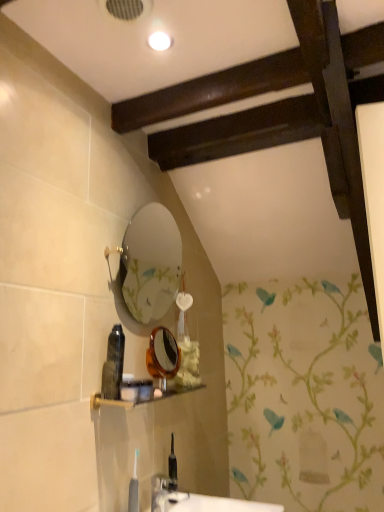
Question: Is matte plastic shelf at lower center at the left side of translucent amber mirror at center?

Choices:
 (A) yes
 (B) no

Answer: (A)

Question: Can you confirm if matte plastic shelf at lower center is taller than translucent amber mirror at center?

Choices:
 (A) yes
 (B) no

Answer: (B)

Question: Considering the relative sizes of matte plastic shelf at lower center and translucent amber mirror at center in the image provided, is matte plastic shelf at lower center bigger than translucent amber mirror at center?

Choices:
 (A) no
 (B) yes

Answer: (A)

Question: Considering the relative sizes of matte plastic shelf at lower center and translucent amber mirror at center in the image provided, is matte plastic shelf at lower center thinner than translucent amber mirror at center?

Choices:
 (A) yes
 (B) no

Answer: (B)

Question: Are matte plastic shelf at lower center and translucent amber mirror at center far apart?

Choices:
 (A) yes
 (B) no

Answer: (B)

Question: Is matte plastic shelf at lower center inside or outside of translucent plastic tube at center, the 2th toiletry from the top?

Choices:
 (A) inside
 (B) outside

Answer: (B)

Question: Looking at the image, does matte plastic shelf at lower center seem bigger or smaller compared to translucent plastic tube at center, acting as the third toiletry starting from the bottom?

Choices:
 (A) big
 (B) small

Answer: (A)

Question: In terms of height, does matte plastic shelf at lower center look taller or shorter compared to translucent plastic tube at center, acting as the third toiletry starting from the bottom?

Choices:
 (A) short
 (B) tall

Answer: (A)

Question: Does point (94, 402) appear closer or farther from the camera than point (139, 391)?

Choices:
 (A) closer
 (B) farther

Answer: (A)

Question: Would you say translucent plastic toothbrush at lower center, the second toiletry ordered from the bottom, is to the left or to the right of translucent amber mirror at center in the picture?

Choices:
 (A) left
 (B) right

Answer: (A)

Question: From a real-world perspective, relative to translucent amber mirror at center, is translucent plastic toothbrush at lower center, the third toiletry when ordered from top to bottom, vertically above or below?

Choices:
 (A) below
 (B) above

Answer: (A)

Question: Is translucent plastic toothbrush at lower center, the third toiletry when ordered from top to bottom, inside or outside of translucent amber mirror at center?

Choices:
 (A) outside
 (B) inside

Answer: (A)

Question: From the image's perspective, is translucent plastic toothbrush at lower center, the second toiletry ordered from the bottom, positioned above or below translucent amber mirror at center?

Choices:
 (A) above
 (B) below

Answer: (B)

Question: Is translucent plastic toothbrush at lower center, the third toiletry when ordered from top to bottom, in front of or behind translucent plastic bottle at center, marked as the 4th toiletry in a bottom-to-top arrangement, in the image?

Choices:
 (A) front
 (B) behind

Answer: (B)

Question: From a real-world perspective, is translucent plastic toothbrush at lower center, the second toiletry ordered from the bottom, above or below translucent plastic bottle at center, which appears as the 1th toiletry when viewed from the top?

Choices:
 (A) below
 (B) above

Answer: (A)